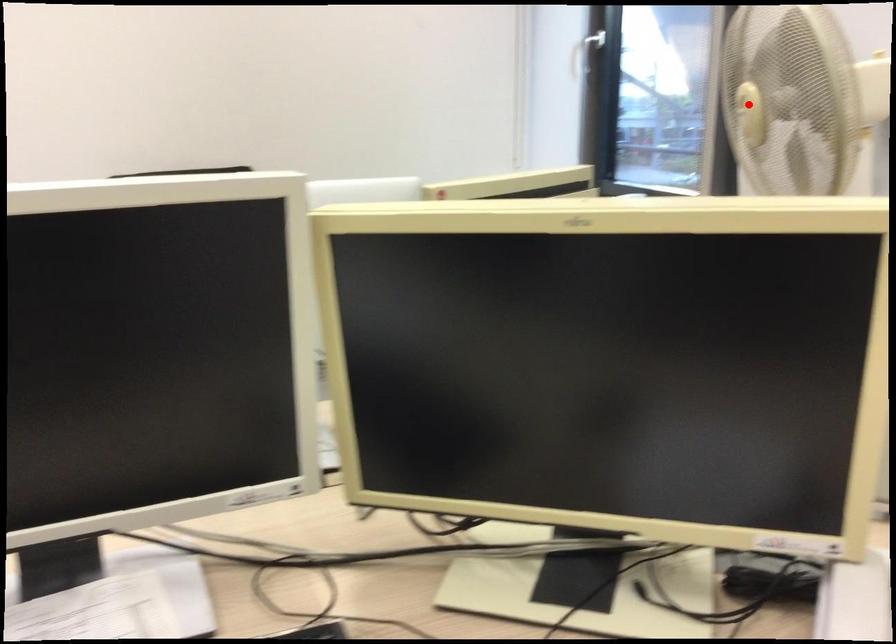
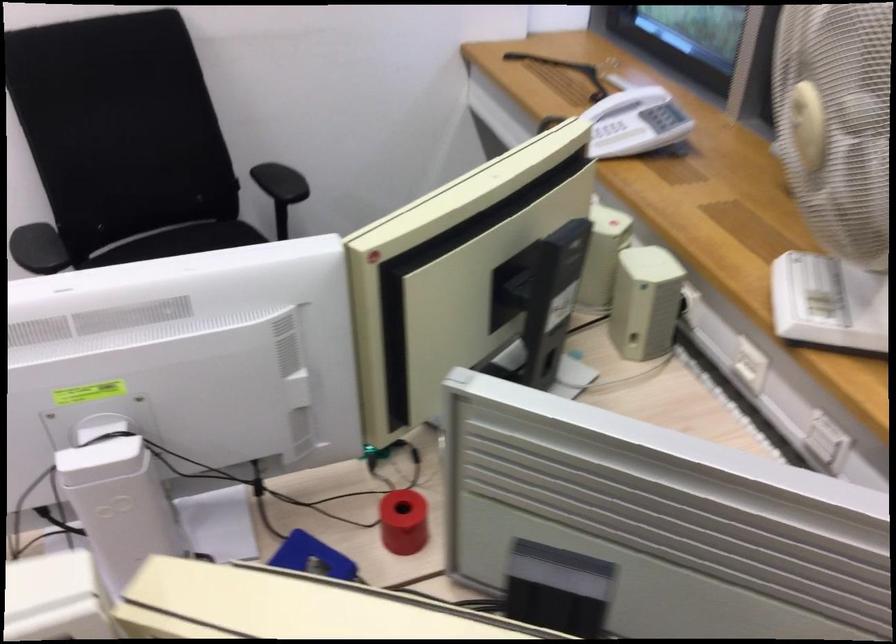
Question: I am providing you with two images of the same scene from different viewpoints. In image1, a red point is highlighted. Considering the same 3D point in image2, which of the following is correct?

Choices:
 (A) It is closer
 (B) It is farther

Answer: (A)